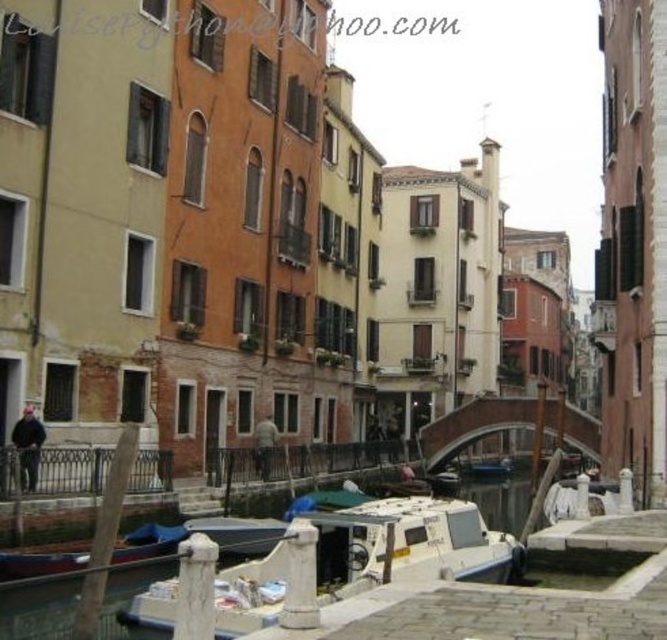
Question: Is white matte boat at center in front of white plastic boat at center?

Choices:
 (A) no
 (B) yes

Answer: (B)

Question: Considering the relative positions of white matte boat at center and white plastic boat at center in the image provided, where is white matte boat at center located with respect to white plastic boat at center?

Choices:
 (A) right
 (B) left

Answer: (B)

Question: Which point is closer to the camera?

Choices:
 (A) (502, 465)
 (B) (247, 620)

Answer: (B)

Question: Can you confirm if white matte boat at center is positioned below white plastic boat at center?

Choices:
 (A) yes
 (B) no

Answer: (B)